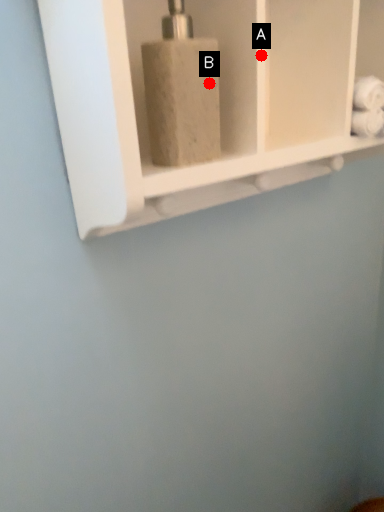
Question: Two points are circled on the image, labeled by A and B beside each circle. Among these points, which one is nearest to the camera?

Choices:
 (A) A is closer
 (B) B is closer

Answer: (B)